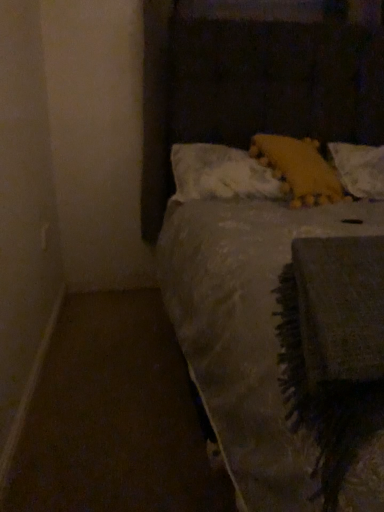
Question: Is yellow fuzzy pillow at upper right, which appears as the second pillow when viewed from the right, positioned behind white fluffy pillow at upper center, the third pillow in the right-to-left sequence?

Choices:
 (A) yes
 (B) no

Answer: (B)

Question: Is yellow fuzzy pillow at upper right, acting as the 2th pillow starting from the left, facing away from white fluffy pillow at upper center, the third pillow in the right-to-left sequence?

Choices:
 (A) no
 (B) yes

Answer: (B)

Question: Is yellow fuzzy pillow at upper right, which appears as the second pillow when viewed from the right, not within white fluffy pillow at upper center, the third pillow in the right-to-left sequence?

Choices:
 (A) no
 (B) yes

Answer: (A)

Question: From the image's perspective, is yellow fuzzy pillow at upper right, acting as the 2th pillow starting from the left, located above white fluffy pillow at upper center, which is the first pillow in left-to-right order?

Choices:
 (A) no
 (B) yes

Answer: (B)

Question: Does yellow fuzzy pillow at upper right, which appears as the second pillow when viewed from the right, appear on the right side of white fluffy pillow at upper center, which is the first pillow in left-to-right order?

Choices:
 (A) yes
 (B) no

Answer: (A)

Question: In terms of width, does yellow fabric pillow at upper right, the third pillow viewed from the left, look wider or thinner when compared to yellow fuzzy pillow at upper right, which appears as the second pillow when viewed from the right?

Choices:
 (A) wide
 (B) thin

Answer: (A)

Question: Is point (375, 196) closer or farther from the camera than point (327, 179)?

Choices:
 (A) closer
 (B) farther

Answer: (A)

Question: From a real-world perspective, relative to yellow fuzzy pillow at upper right, which appears as the second pillow when viewed from the right, is yellow fabric pillow at upper right, marked as the 1th pillow in a right-to-left arrangement, vertically above or below?

Choices:
 (A) below
 (B) above

Answer: (A)

Question: In terms of size, does yellow fabric pillow at upper right, marked as the 1th pillow in a right-to-left arrangement, appear bigger or smaller than yellow fuzzy pillow at upper right, which appears as the second pillow when viewed from the right?

Choices:
 (A) small
 (B) big

Answer: (A)

Question: Is yellow fabric pillow at upper right, marked as the 1th pillow in a right-to-left arrangement, wider or thinner than white fluffy pillow at upper center, the third pillow in the right-to-left sequence?

Choices:
 (A) wide
 (B) thin

Answer: (A)

Question: Is yellow fabric pillow at upper right, the third pillow viewed from the left, bigger or smaller than white fluffy pillow at upper center, which is the first pillow in left-to-right order?

Choices:
 (A) big
 (B) small

Answer: (B)

Question: From a real-world perspective, is yellow fabric pillow at upper right, marked as the 1th pillow in a right-to-left arrangement, physically located above or below white fluffy pillow at upper center, the third pillow in the right-to-left sequence?

Choices:
 (A) below
 (B) above

Answer: (A)

Question: From the image's perspective, is yellow fabric pillow at upper right, marked as the 1th pillow in a right-to-left arrangement, positioned above or below white fluffy pillow at upper center, which is the first pillow in left-to-right order?

Choices:
 (A) below
 (B) above

Answer: (B)

Question: Would you say yellow fuzzy pillow at upper right, acting as the 2th pillow starting from the left, is to the left or to the right of white fluffy pillow at upper center, which is the first pillow in left-to-right order, in the picture?

Choices:
 (A) right
 (B) left

Answer: (A)

Question: From the image's perspective, is yellow fuzzy pillow at upper right, which appears as the second pillow when viewed from the right, located above or below white fluffy pillow at upper center, which is the first pillow in left-to-right order?

Choices:
 (A) above
 (B) below

Answer: (A)